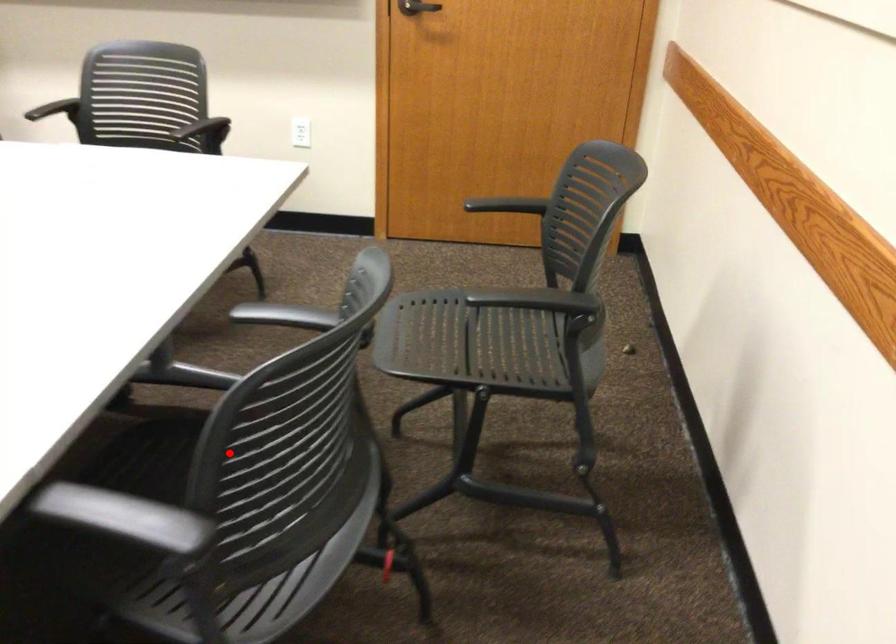
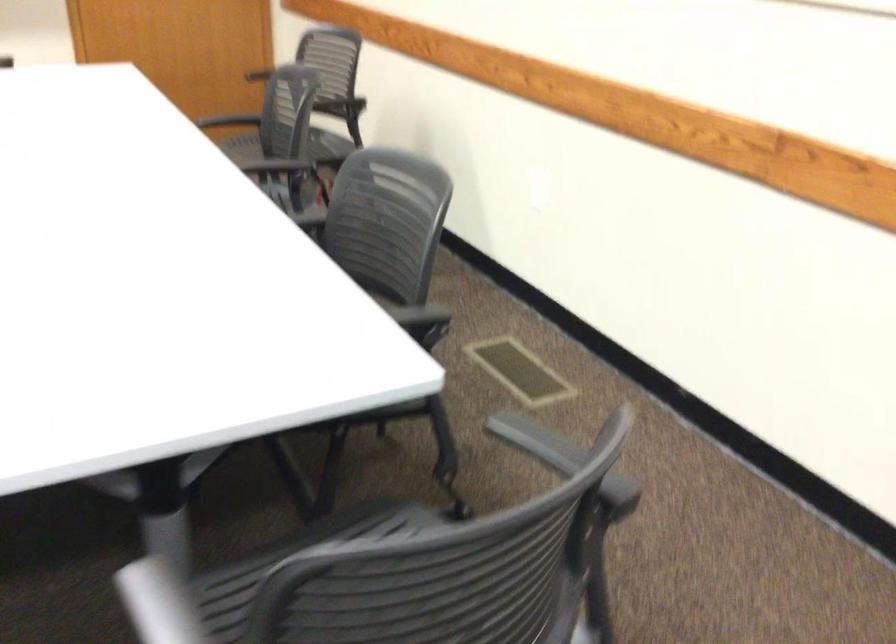
Find the pixel in the second image that matches the highlighted location in the first image.

(294, 144)